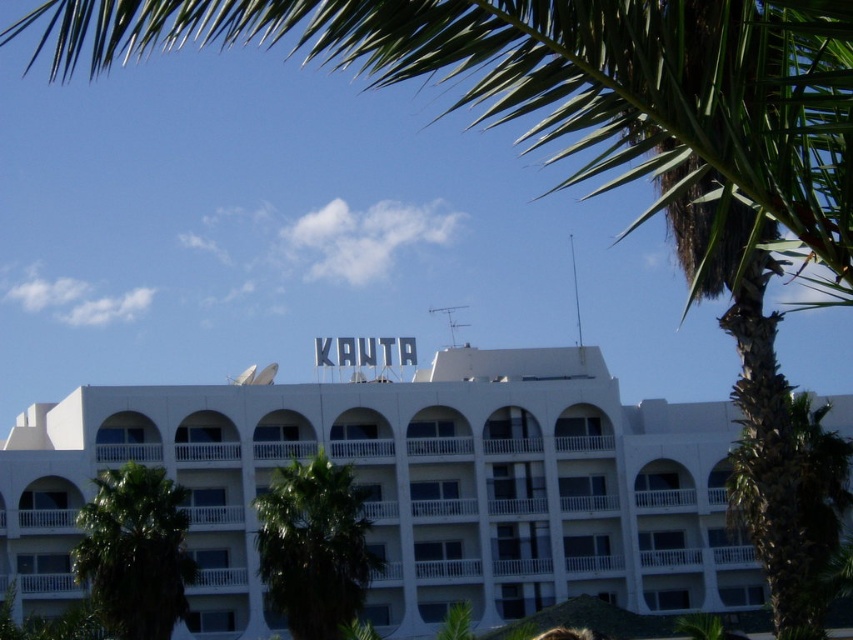
Question: Can you confirm if white matte building at center is thinner than green leafy palm tree at lower left?

Choices:
 (A) yes
 (B) no

Answer: (B)

Question: Does white matte building at center have a lesser width compared to green leafy palm tree at upper right?

Choices:
 (A) no
 (B) yes

Answer: (A)

Question: Among these points, which one is farthest from the camera?

Choices:
 (A) (741, 595)
 (B) (120, 632)
 (C) (263, 524)
 (D) (799, 632)

Answer: (A)

Question: Is white matte building at center further to the viewer compared to green leafy palm tree at lower left?

Choices:
 (A) no
 (B) yes

Answer: (B)

Question: Which of the following is the closest to the observer?

Choices:
 (A) white matte building at center
 (B) green leafy palm tree at upper right
 (C) green leafy palm tree at lower left

Answer: (B)

Question: Which object is the farthest from the green leafy palm tree at upper right?

Choices:
 (A) green leafy palm tree at center
 (B) white matte building at center
 (C) green leafy palm tree at lower left

Answer: (C)